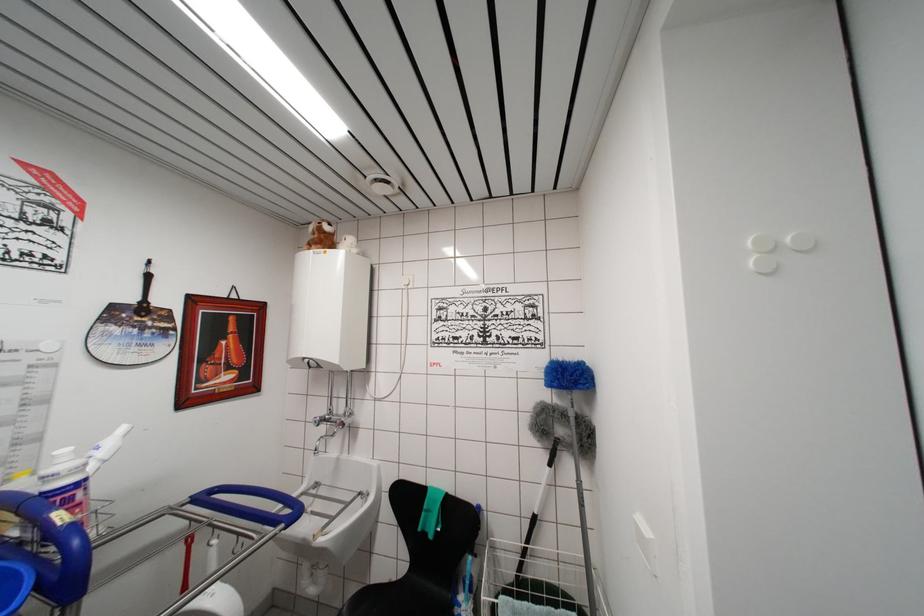
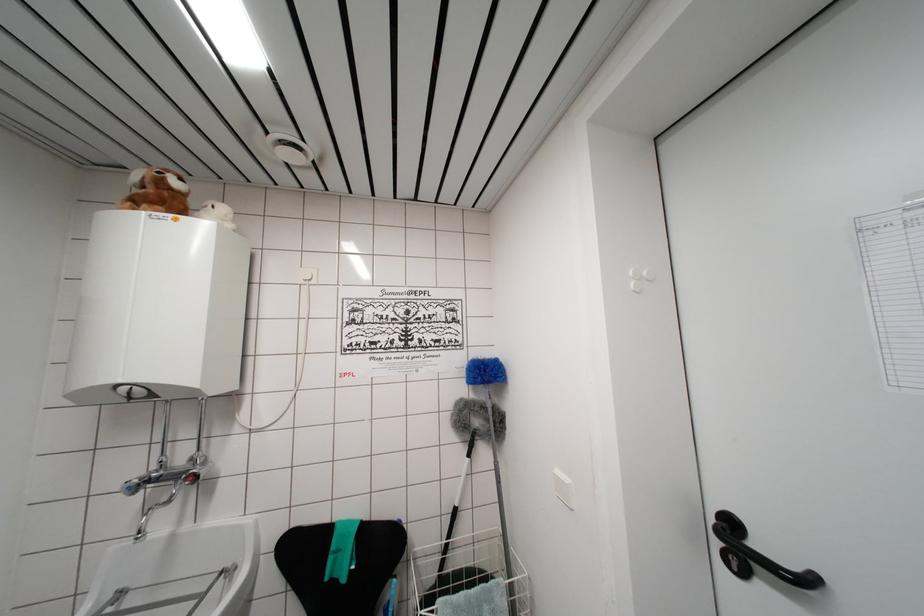
Question: What movement of the cameraman would produce the second image?

Choices:
 (A) Left
 (B) Right
 (C) Forward
 (D) Backward

Answer: (A)